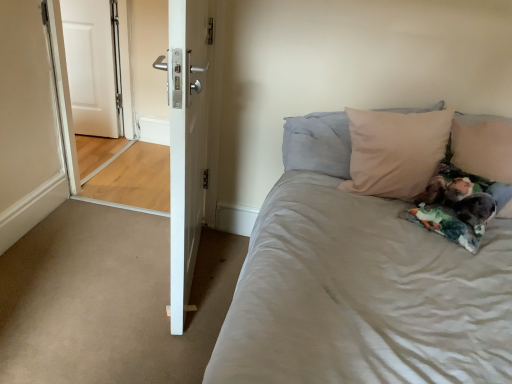
Locate an element on the screen. The image size is (512, 384). vacant space in front of white glossy door at center, the 2th door from the left is located at coordinates (131, 333).